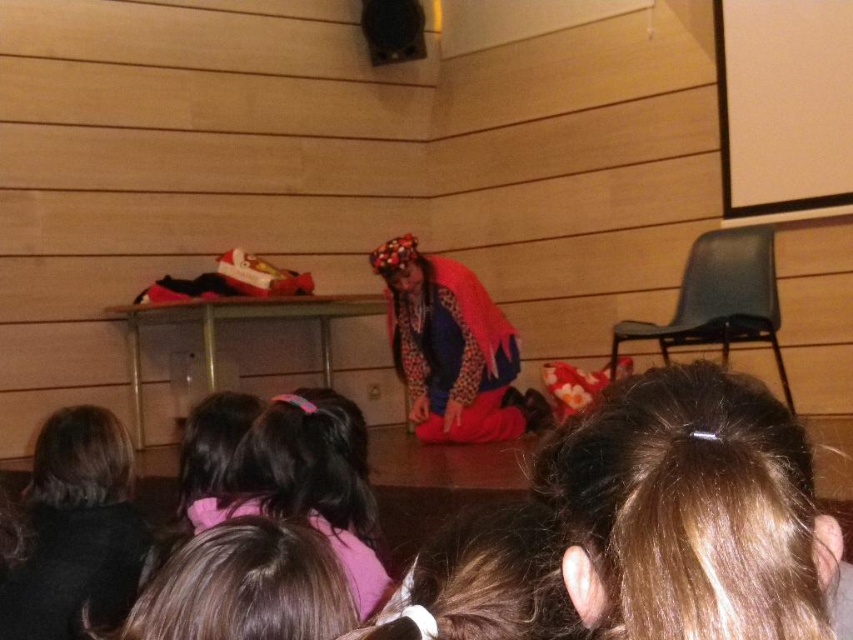
Who is higher up, brown hair at upper center or pink fabric hairband at center?

brown hair at upper center

Does brown hair at upper center have a larger size compared to pink fabric hairband at center?

Incorrect, brown hair at upper center is not larger than pink fabric hairband at center.

Does point (708, 454) lie behind point (373, 586)?

No, (708, 454) is in front of (373, 586).

Locate an element on the screen. The height and width of the screenshot is (640, 853). brown hair at upper center is located at coordinates (694, 513).

Can you confirm if dark brown hair at lower left is wider than velvet red cape at center?

No.

Is point (91, 529) more distant than point (474, 337)?

No, it is not.

The image size is (853, 640). Identify the location of dark brown hair at lower left. coord(76,531).

Can you confirm if brown hair at upper center is positioned above velvet red cape at center?

No.

Who is taller, brown hair at upper center or velvet red cape at center?

With more height is velvet red cape at center.

At what (x,y) coordinates should I click in order to perform the action: click on brown hair at upper center. Please return your answer as a coordinate pair (x, y). This screenshot has width=853, height=640. Looking at the image, I should click on (694, 513).